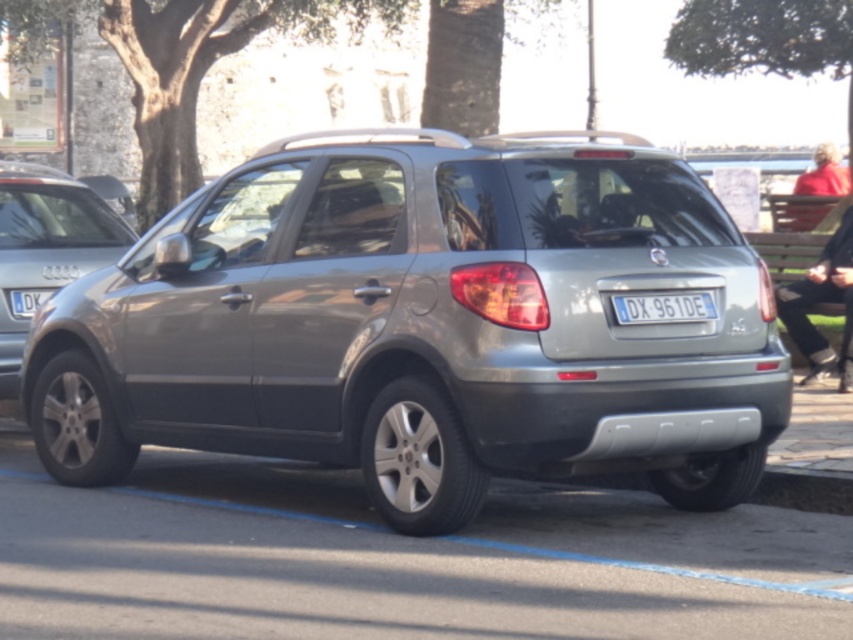
Question: Which of these objects is positioned farthest from the red sweater at right?

Choices:
 (A) blue metallic license plate at lower left
 (B) gray asphalt at lower center
 (C) satin silver suv at left
 (D) white plastic license plate at center

Answer: (C)

Question: Which object is the closest to the red fabric jacket at upper right?

Choices:
 (A) satin silver suv at left
 (B) satin silver suv at center
 (C) red sweater at right

Answer: (C)

Question: Is satin silver suv at center thinner than red sweater at right?

Choices:
 (A) no
 (B) yes

Answer: (A)

Question: Estimate the real-world distances between objects in this image. Which object is closer to the satin silver suv at center?

Choices:
 (A) red fabric jacket at upper right
 (B) blue metallic license plate at lower left
 (C) red sweater at right

Answer: (B)

Question: Is satin silver suv at left positioned in front of red fabric jacket at upper right?

Choices:
 (A) no
 (B) yes

Answer: (A)

Question: Does satin silver suv at center appear over red sweater at right?

Choices:
 (A) no
 (B) yes

Answer: (A)